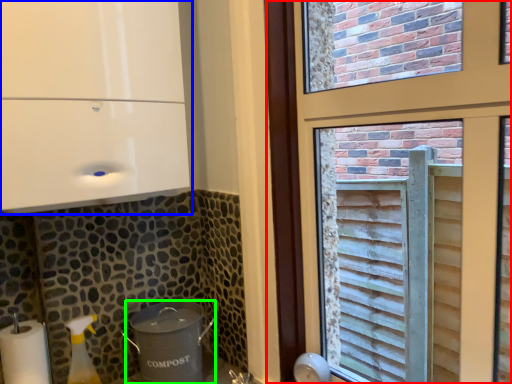
Question: Estimate the real-world distances between objects in this image. Which object is closer to window (highlighted by a red box), appliance (highlighted by a blue box) or appliance (highlighted by a green box)?

Choices:
 (A) appliance
 (B) appliance

Answer: (A)